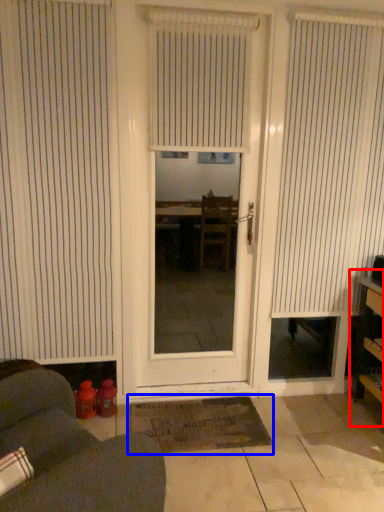
Question: Among these objects, which one is farthest to the camera, bookshelf (highlighted by a red box) or doormat (highlighted by a blue box)?

Choices:
 (A) bookshelf
 (B) doormat

Answer: (B)